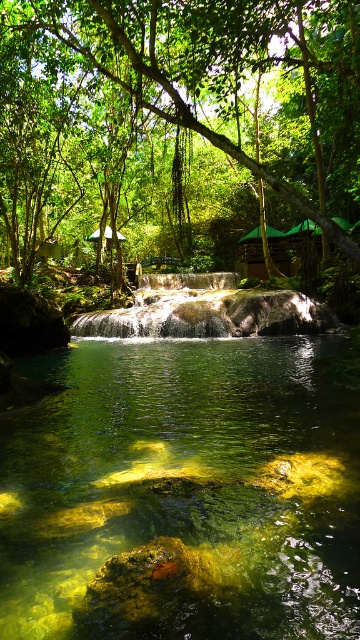
Question: Does translucent green water at center have a smaller size compared to green leafy tree at center?

Choices:
 (A) no
 (B) yes

Answer: (B)

Question: Which object is closer to the camera taking this photo?

Choices:
 (A) green leafy tree at center
 (B) translucent green water at center

Answer: (B)

Question: Which point is farther to the camera?

Choices:
 (A) (182, 355)
 (B) (147, 10)

Answer: (A)

Question: Which of the following is the farthest from the observer?

Choices:
 (A) (297, 394)
 (B) (315, 0)

Answer: (B)

Question: Where is translucent green water at center located in relation to green leafy tree at center in the image?

Choices:
 (A) above
 (B) below

Answer: (B)

Question: Can you confirm if translucent green water at center is thinner than green leafy tree at center?

Choices:
 (A) no
 (B) yes

Answer: (B)